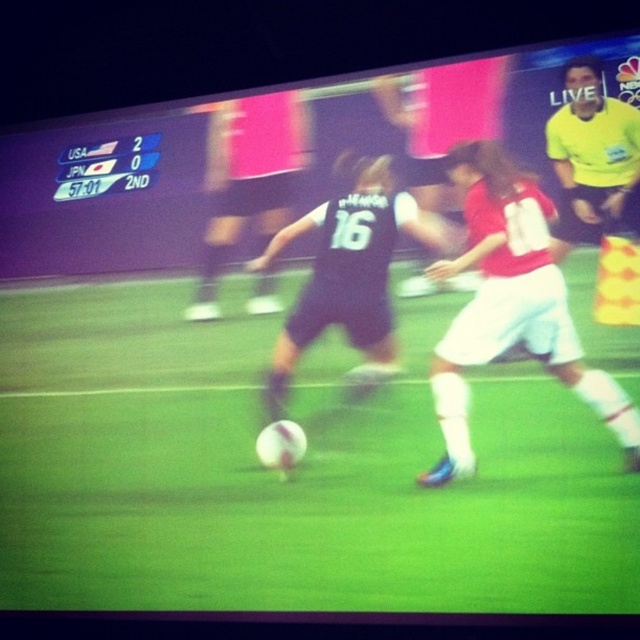
Question: Which point appears closest to the camera in this image?

Choices:
 (A) (192, 384)
 (B) (253, 305)

Answer: (A)

Question: Can you confirm if green grass football field at center is thinner than black matte soccer player at center?

Choices:
 (A) no
 (B) yes

Answer: (A)

Question: Is green grass football field at center above black matte soccer player at center?

Choices:
 (A) yes
 (B) no

Answer: (B)

Question: Which of the following is the farthest from the observer?

Choices:
 (A) (301, 124)
 (B) (330, 378)

Answer: (A)

Question: Where is black matte soccer player at center located in relation to yellow/yellowish-green jersey at upper right in the image?

Choices:
 (A) right
 (B) left

Answer: (B)

Question: Which object is the closest to the yellow/yellowish-green jersey at upper right?

Choices:
 (A) green grass football field at center
 (B) black matte soccer player at center

Answer: (A)